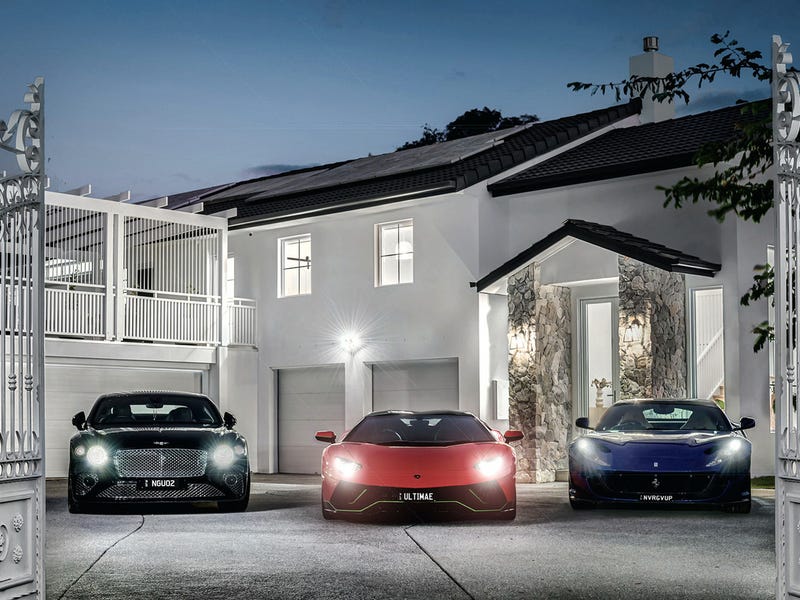
At what (x,y) coordinates should I click in order to perform the action: click on left top window. Please return your answer as a coordinate pair (x, y). The width and height of the screenshot is (800, 600). Looking at the image, I should click on (293, 271).